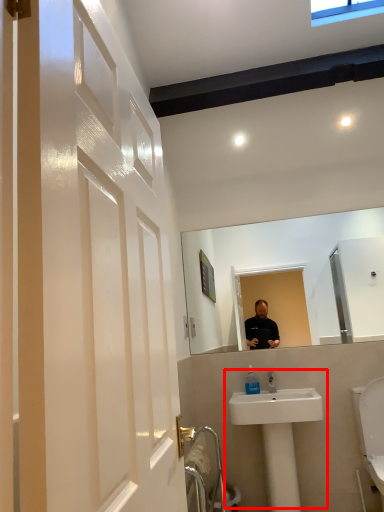
Question: Considering the relative positions of sink (annotated by the red box) and toiletry in the image provided, where is sink (annotated by the red box) located with respect to the staircase?

Choices:
 (A) right
 (B) left

Answer: (A)